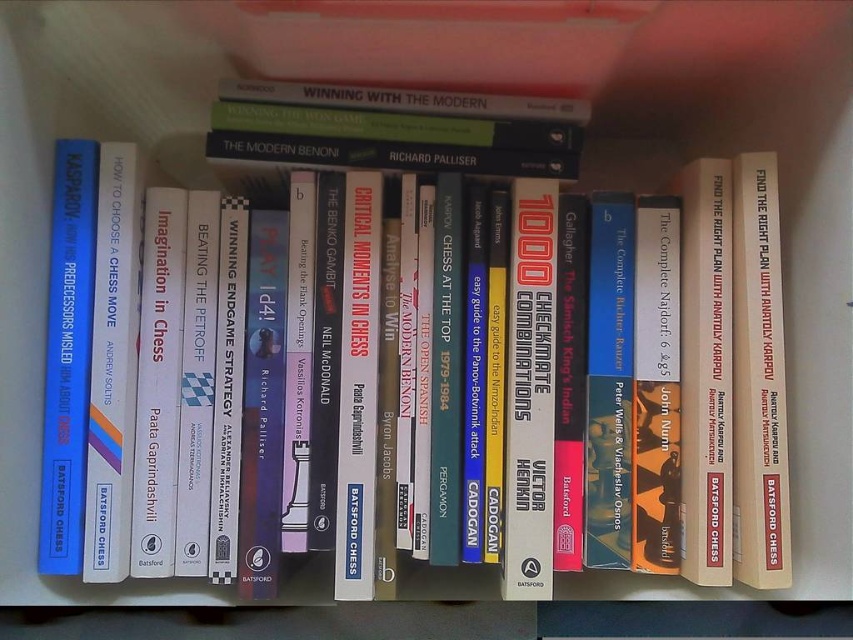
Is point (735, 518) positioned before point (722, 208)?

Yes, point (735, 518) is in front of point (722, 208).

How distant is white matte book at center-right from hardcover book at center?

0.86 inches

The height and width of the screenshot is (640, 853). In order to click on white matte book at center-right in this screenshot , I will do `click(758, 380)`.